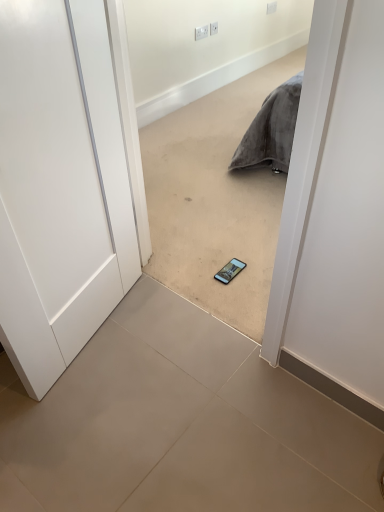
Question: Does white plastic electric outlet at upper center, which is the second electric outlet from left to right, have a larger size compared to white matte door at left?

Choices:
 (A) yes
 (B) no

Answer: (B)

Question: Is white plastic electric outlet at upper center, which is the second electric outlet from left to right, not near white matte door at left?

Choices:
 (A) no
 (B) yes

Answer: (B)

Question: Can you confirm if white plastic electric outlet at upper center, which is the second electric outlet from left to right, is taller than white matte door at left?

Choices:
 (A) no
 (B) yes

Answer: (A)

Question: Is white plastic electric outlet at upper center, which is the second electric outlet from left to right, turned away from white matte door at left?

Choices:
 (A) no
 (B) yes

Answer: (A)

Question: Can you confirm if white plastic electric outlet at upper center, arranged as the first electric outlet when viewed from the right, is thinner than white matte door at left?

Choices:
 (A) no
 (B) yes

Answer: (B)

Question: Do you think matte gray tile at center is within white plastic electric outlet at upper center, which is the second electric outlet from left to right, or outside of it?

Choices:
 (A) inside
 (B) outside

Answer: (B)

Question: In terms of height, does matte gray tile at center look taller or shorter compared to white plastic electric outlet at upper center, which is the second electric outlet from left to right?

Choices:
 (A) tall
 (B) short

Answer: (B)

Question: Is matte gray tile at center wider or thinner than white plastic electric outlet at upper center, arranged as the first electric outlet when viewed from the right?

Choices:
 (A) wide
 (B) thin

Answer: (A)

Question: Does point (61, 460) appear closer or farther from the camera than point (216, 29)?

Choices:
 (A) closer
 (B) farther

Answer: (A)

Question: From the image's perspective, is white plastic electric outlet at upper center, which appears as the first electric outlet when viewed from the left, positioned above or below matte gray tile at center?

Choices:
 (A) above
 (B) below

Answer: (A)

Question: Which is correct: white plastic electric outlet at upper center, which appears as the first electric outlet when viewed from the left, is inside matte gray tile at center, or outside of it?

Choices:
 (A) outside
 (B) inside

Answer: (A)

Question: Is point (198, 28) closer or farther from the camera than point (84, 365)?

Choices:
 (A) farther
 (B) closer

Answer: (A)

Question: Based on their sizes in the image, would you say white plastic electric outlet at upper center, which appears as the first electric outlet when viewed from the left, is bigger or smaller than matte gray tile at center?

Choices:
 (A) big
 (B) small

Answer: (B)

Question: In terms of size, does white plastic electric outlet at upper center, which appears as the first electric outlet when viewed from the left, appear bigger or smaller than white plastic electric outlet at upper center, which is the second electric outlet from left to right?

Choices:
 (A) big
 (B) small

Answer: (A)

Question: In terms of width, does white plastic electric outlet at upper center, the second electric outlet in the right-to-left sequence, look wider or thinner when compared to white plastic electric outlet at upper center, which is the second electric outlet from left to right?

Choices:
 (A) thin
 (B) wide

Answer: (B)